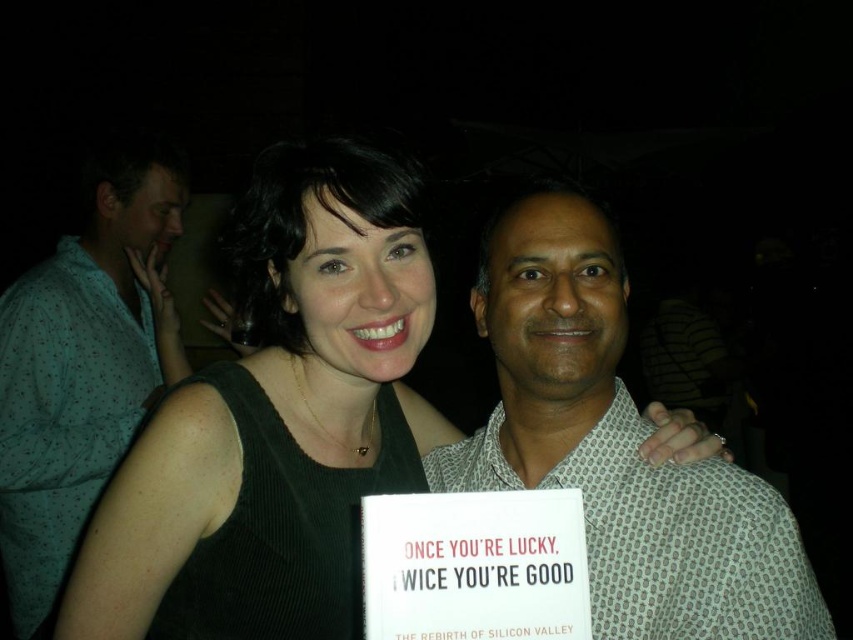
Question: Which is farther from the black fabric dress at center?

Choices:
 (A) white dotted shirt at center
 (B) white paper sign at center
 (C) green dotted shirt at left

Answer: (C)

Question: Can you confirm if black fabric dress at center is wider than green dotted shirt at left?

Choices:
 (A) no
 (B) yes

Answer: (B)

Question: Can you confirm if black fabric dress at center is positioned above white paper sign at center?

Choices:
 (A) no
 (B) yes

Answer: (B)

Question: Which point appears farthest from the camera in this image?

Choices:
 (A) (514, 298)
 (B) (68, 547)
 (C) (405, 294)

Answer: (B)

Question: Among these objects, which one is farthest from the camera?

Choices:
 (A) white dotted shirt at center
 (B) white paper sign at center

Answer: (A)

Question: Does black fabric dress at center appear over white paper sign at center?

Choices:
 (A) no
 (B) yes

Answer: (B)